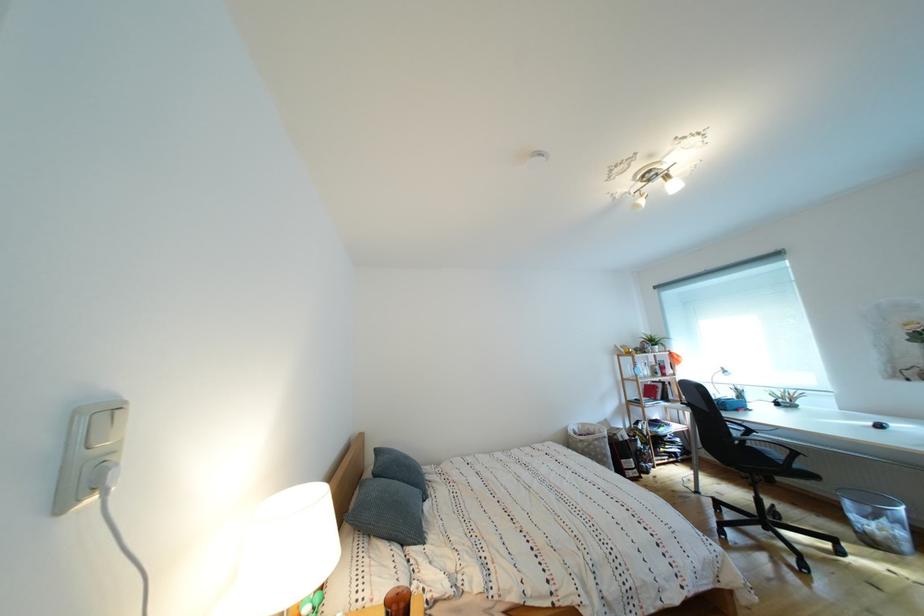
Describe the element at coordinates (769, 469) in the screenshot. I see `the chair sitting surface` at that location.